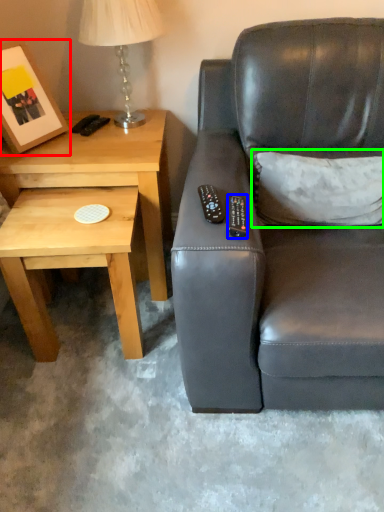
Question: Based on their relative distances, which object is farther from picture frame (highlighted by a red box)? Choose from remote (highlighted by a blue box) and throw pillow (highlighted by a green box).

Choices:
 (A) remote
 (B) throw pillow

Answer: (B)